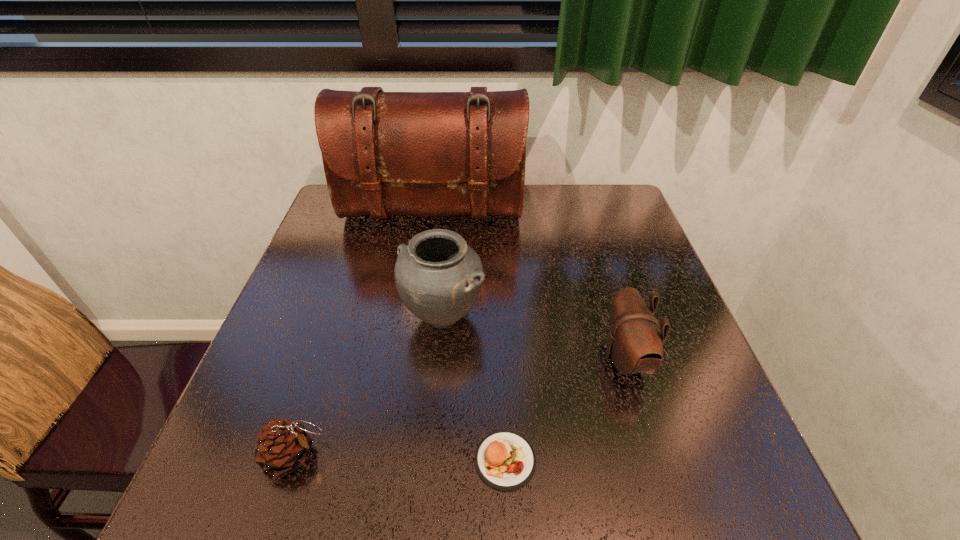
The width and height of the screenshot is (960, 540). I want to click on object that is positioned at the far left corner, so click(x=384, y=153).

The image size is (960, 540). I want to click on object that is positioned at the near left corner, so click(282, 446).

The height and width of the screenshot is (540, 960). Find the location of `vacant space at the far edge of the desktop`. vacant space at the far edge of the desktop is located at coordinates (574, 202).

At what (x,y) coordinates should I click in order to perform the action: click on free space at the near edge of the desktop. Please return your answer as a coordinate pair (x, y). Looking at the image, I should click on (429, 503).

Image resolution: width=960 pixels, height=540 pixels. I want to click on free region at the left edge of the desktop, so click(x=323, y=339).

What are the coordinates of `vacant space at the right edge` in the screenshot? It's located at (593, 235).

The image size is (960, 540). Find the location of `vacant space at the far left corner`. vacant space at the far left corner is located at coordinates (366, 217).

What are the coordinates of `vacant area at the near left corner of the desktop` in the screenshot? It's located at (234, 468).

At what (x,y) coordinates should I click in order to perform the action: click on free space at the far right corner of the desktop. Please return your answer as a coordinate pair (x, y). The image size is (960, 540). Looking at the image, I should click on (594, 200).

Where is `vacant space at the near right corner of the desktop`? The width and height of the screenshot is (960, 540). vacant space at the near right corner of the desktop is located at coordinates [x=679, y=500].